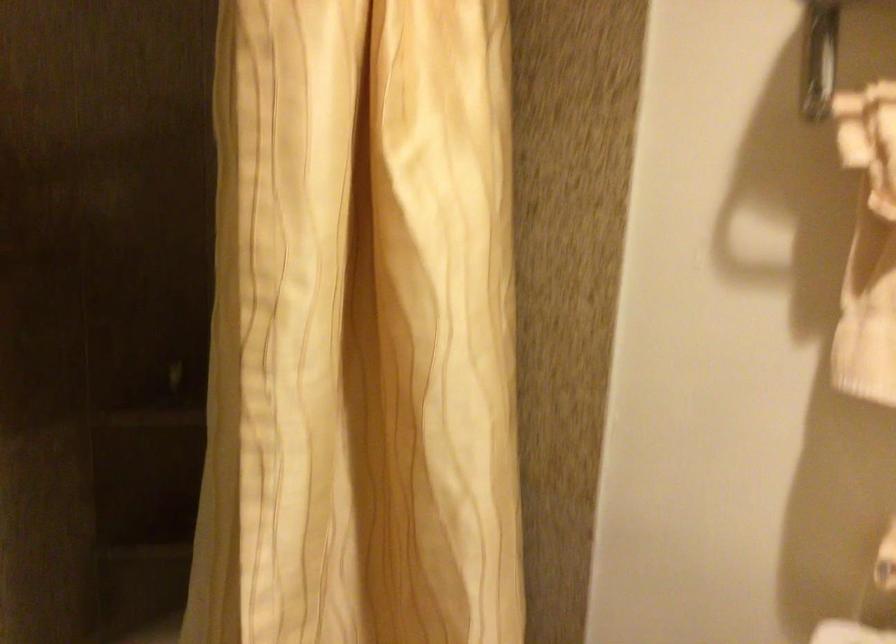
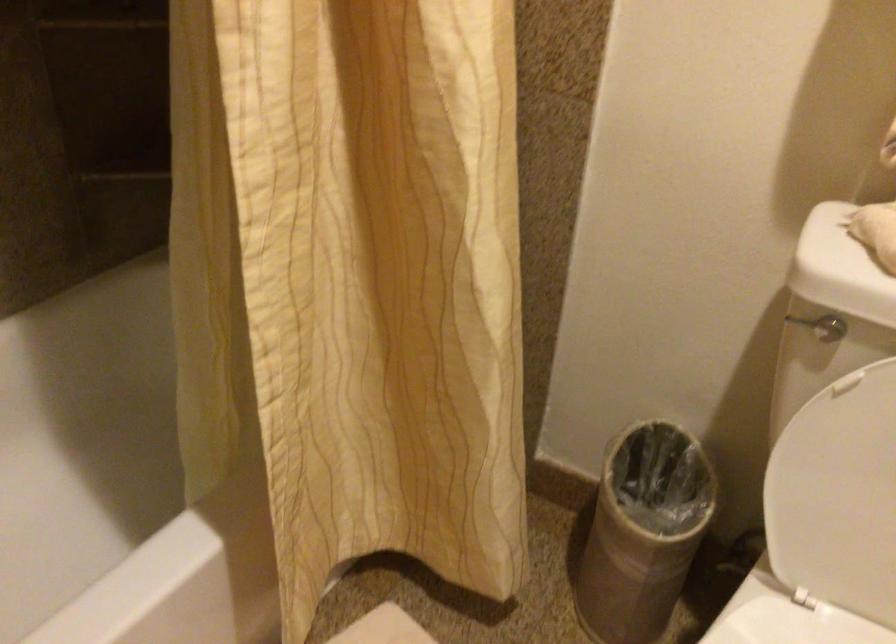
Question: Based on the continuous images, in which direction is the camera rotating? Reply with the corresponding letter.

Choices:
 (A) Left
 (B) Right
 (C) Up
 (D) Down

Answer: (D)